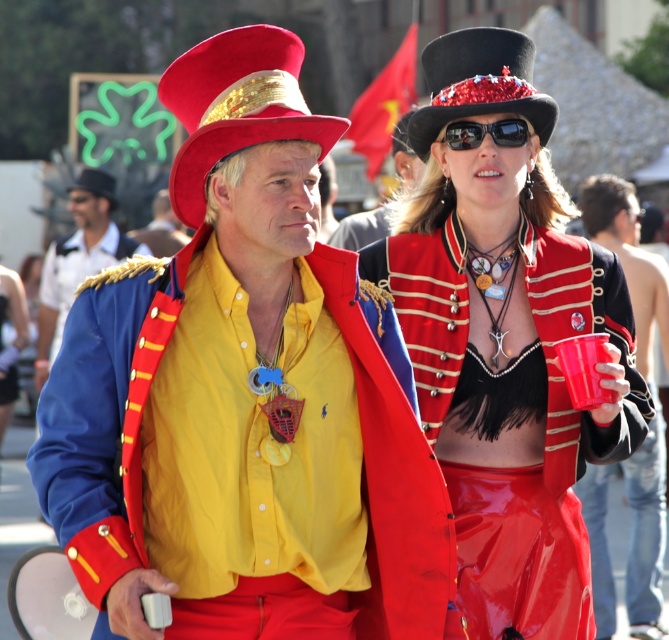
Is shiny red skirt at center positioned behind red velvet top hat at upper center?

No, it is not.

Who is more forward, (1, 332) or (86, 189)?

Point (86, 189)

Find the location of `shiny red skirt at center`. shiny red skirt at center is located at coordinates (11, 340).

This screenshot has height=640, width=669. What do you see at coordinates (630, 260) in the screenshot?
I see `matte plastic cup at right` at bounding box center [630, 260].

Who is positioned more to the right, matte plastic cup at right or blue satin jacket at left?

Positioned to the right is matte plastic cup at right.

Is point (630, 230) farther from camera compared to point (72, 211)?

No, (630, 230) is in front of (72, 211).

The height and width of the screenshot is (640, 669). Find the location of `matte plastic cup at right`. matte plastic cup at right is located at coordinates [x=630, y=260].

Which is more to the right, matte plastic cup at right or red velvet top hat at upper center?

matte plastic cup at right is more to the right.

Can you confirm if matte plastic cup at right is shorter than red velvet top hat at upper center?

In fact, matte plastic cup at right may be taller than red velvet top hat at upper center.

Where is `matte plastic cup at right`? Image resolution: width=669 pixels, height=640 pixels. matte plastic cup at right is located at coordinates (630, 260).

Locate an element on the screen. The image size is (669, 640). matte plastic cup at right is located at coordinates (630, 260).